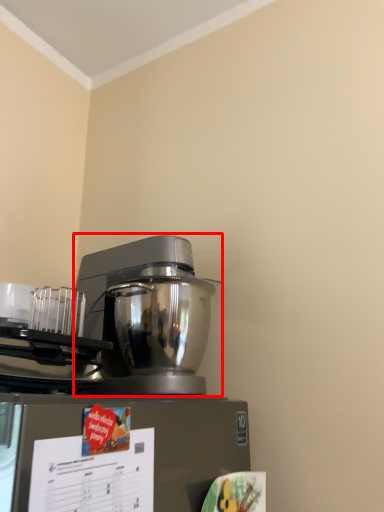
Question: In this image, where is mixer (annotated by the red box) located relative to appliance?

Choices:
 (A) left
 (B) right

Answer: (B)